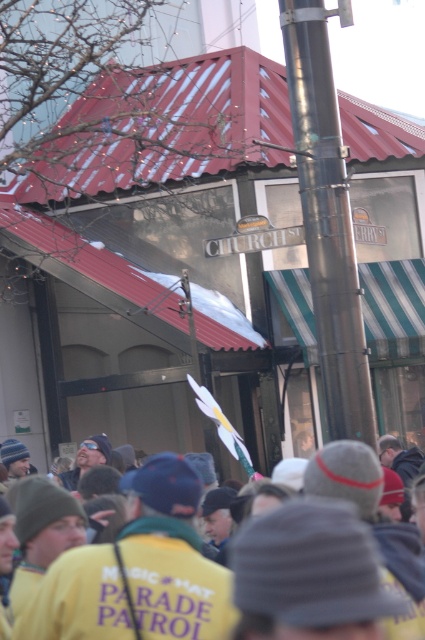
Question: Is yellow fabric at center wider than polished metal pole at center?

Choices:
 (A) no
 (B) yes

Answer: (B)

Question: Which of the following is the closest to the observer?

Choices:
 (A) yellow fabric at center
 (B) polished metal pole at center

Answer: (A)

Question: Can you confirm if yellow fabric at center is positioned above polished metal pole at center?

Choices:
 (A) yes
 (B) no

Answer: (B)

Question: Which of the following is the closest to the observer?

Choices:
 (A) (156, 552)
 (B) (294, 54)

Answer: (A)

Question: From the image, what is the correct spatial relationship of yellow fabric at center in relation to polished metal pole at center?

Choices:
 (A) left
 (B) right

Answer: (A)